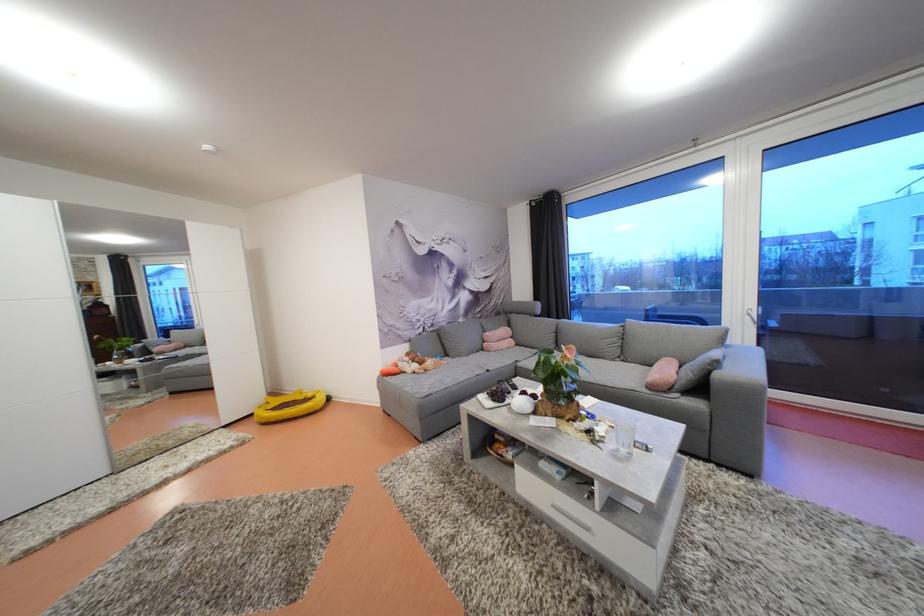
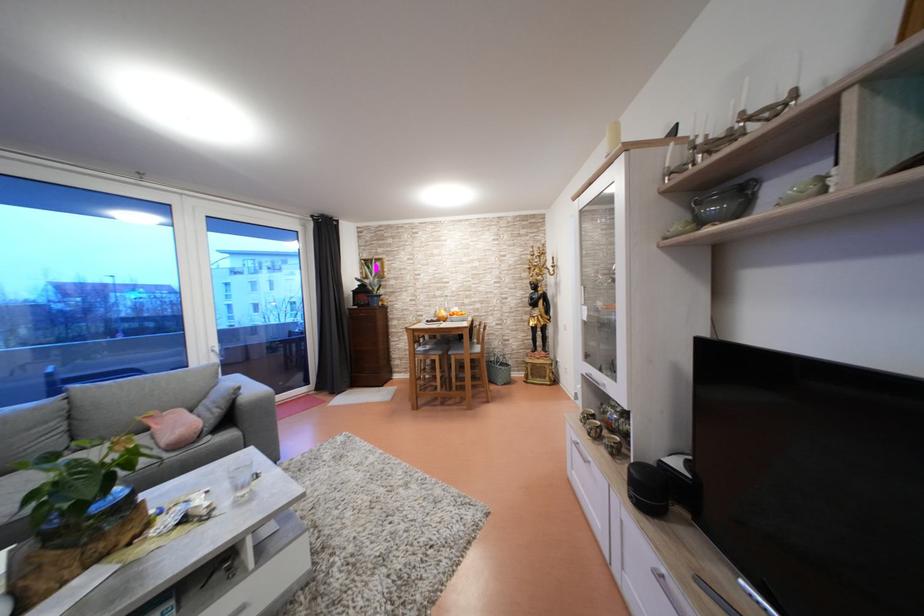
The point at (x=576, y=365) is marked in the first image. Where is the corresponding point in the second image?

(139, 446)